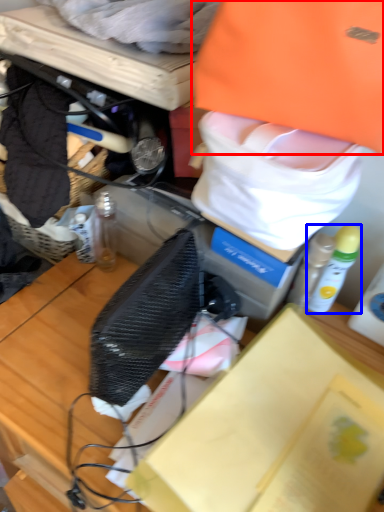
Question: Among these objects, which one is farthest to the camera, clothing (highlighted by a red box) or bottle (highlighted by a blue box)?

Choices:
 (A) clothing
 (B) bottle

Answer: (B)